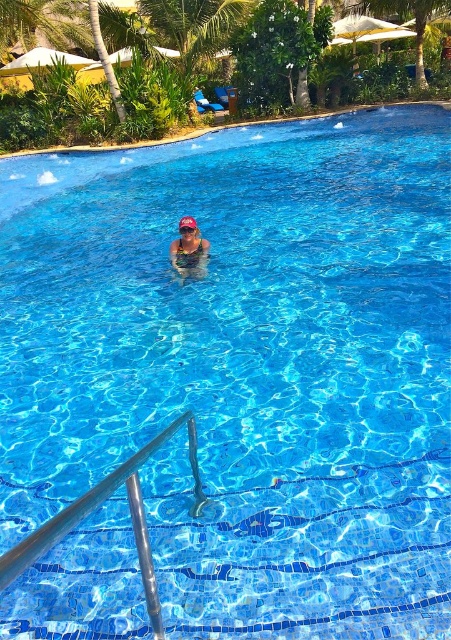
Question: Which object is closer to the camera taking this photo?

Choices:
 (A) matte blue swimsuit at center
 (B) transparent plastic goggles at center
 (C) silver metallic rail at lower left

Answer: (C)

Question: Is matte blue swimsuit at center to the right of transparent plastic goggles at center from the viewer's perspective?

Choices:
 (A) yes
 (B) no

Answer: (A)

Question: Which point is farther to the camera?

Choices:
 (A) silver metallic rail at lower left
 (B) matte blue swimsuit at center

Answer: (B)

Question: Is silver metallic rail at lower left bigger than matte blue swimsuit at center?

Choices:
 (A) yes
 (B) no

Answer: (A)

Question: Among these objects, which one is farthest from the camera?

Choices:
 (A) matte blue swimsuit at center
 (B) transparent plastic goggles at center

Answer: (B)

Question: Can you confirm if matte blue swimsuit at center is positioned to the left of transparent plastic goggles at center?

Choices:
 (A) no
 (B) yes

Answer: (A)